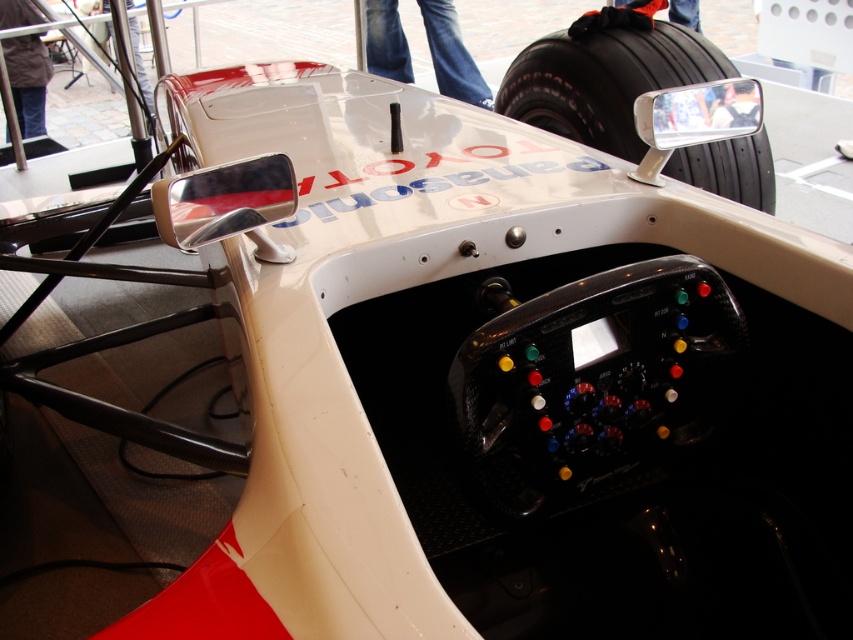
You are a mechanic working on a Formula One car and need to reach the black rubber tire at upper right. Your tool box is placed 3 meters away from the camera. Can you safely access the tire without moving the tool box?

The black rubber tire at upper right is 2.70 meters from the camera, which is closer than the tool box placed 3 meters away. Therefore, you can safely access the tire without moving the tool box.

You are a Formula One driver sitting in the cockpit. You need to press a button located at point (x=628, y=58) and another button at point (x=405, y=77). Which button should you reach for first if you want to press them in order from closest to farthest from your current position?

Point (x=628, y=58) is in front of point (x=405, y=77), so you should press point (x=628, y=58) first as it is closer to you, followed by point (x=405, y=77) which is farther away.